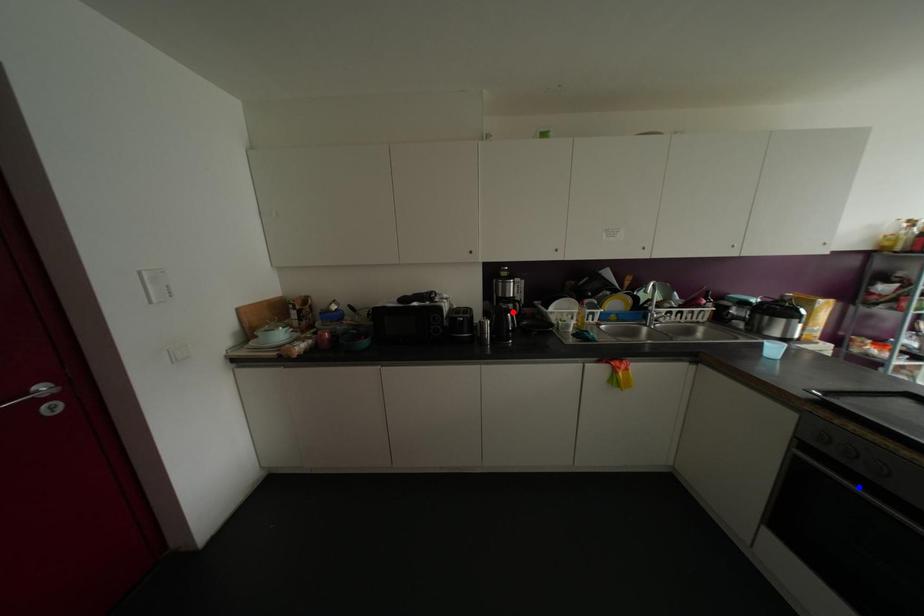
Question: Which of the two points in the image is closer to the camera?

Choices:
 (A) Blue point is closer.
 (B) Red point is closer.

Answer: (A)